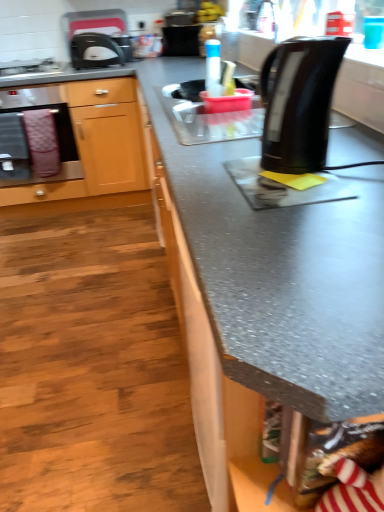
The width and height of the screenshot is (384, 512). What are the coordinates of `pink fabric towel at left` in the screenshot? It's located at (42, 142).

What is the approximate width of black glossy electric kettle at right?

It is 6.28 inches.

The height and width of the screenshot is (512, 384). I want to click on black glossy electric kettle at right, so click(x=299, y=102).

Identify the location of stainless steel oven at left. This screenshot has height=512, width=384. (36, 137).

Describe the element at coordinates (36, 137) in the screenshot. The width and height of the screenshot is (384, 512). I see `stainless steel oven at left` at that location.

This screenshot has height=512, width=384. Identify the location of black plastic toaster at upper left. (94, 51).

Describe the element at coordinates (97, 38) in the screenshot. I see `matte black toaster at upper left` at that location.

Find the location of `pink fabric towel at left`. pink fabric towel at left is located at coordinates (42, 142).

Considering the relative positions of white glossy gas stove at upper left and wooden cabinet at left in the image provided, is white glossy gas stove at upper left to the left of wooden cabinet at left from the viewer's perspective?

Yes.

From a real-world perspective, is white glossy gas stove at upper left on wooden cabinet at left?

Yes, from a real-world perspective, white glossy gas stove at upper left is over wooden cabinet at left

From the image's perspective, relative to wooden cabinet at left, is white glossy gas stove at upper left above or below?

white glossy gas stove at upper left is situated higher than wooden cabinet at left in the image.

From the picture: From the image's perspective, is matte black toaster at upper left above black glossy electric kettle at right?

Yes, from the image's perspective, matte black toaster at upper left is over black glossy electric kettle at right.

Is matte black toaster at upper left aimed at black glossy electric kettle at right?

Yes, matte black toaster at upper left is oriented towards black glossy electric kettle at right.

From a real-world perspective, is matte black toaster at upper left located beneath black glossy electric kettle at right?

No, from a real-world perspective, matte black toaster at upper left is not under black glossy electric kettle at right.

Is matte black toaster at upper left positioned beyond the bounds of black glossy electric kettle at right?

Absolutely, matte black toaster at upper left is external to black glossy electric kettle at right.

Is white glossy gas stove at upper left located outside pink fabric towel at left?

Yes, white glossy gas stove at upper left is located beyond the bounds of pink fabric towel at left.

What's the angular difference between white glossy gas stove at upper left and pink fabric towel at left's facing directions?

There is a 0.488-degree angle between the facing directions of white glossy gas stove at upper left and pink fabric towel at left.

From a real-world perspective, is white glossy gas stove at upper left above or below pink fabric towel at left?

white glossy gas stove at upper left is above pink fabric towel at left.

From the image's perspective, is white glossy gas stove at upper left on pink fabric towel at left?

Yes, from the image's perspective, white glossy gas stove at upper left is above pink fabric towel at left.

Does point (97, 170) come in front of point (10, 74)?

That is False.

Identify the location of gas stove behind the wooden cabinet at left. The width and height of the screenshot is (384, 512). (31, 67).

Between wooden cabinet at left and white glossy gas stove at upper left, which one has smaller width?

Thinner between the two is white glossy gas stove at upper left.

Is wooden cabinet at left located outside white glossy gas stove at upper left?

Yes.

From a real-world perspective, between black plastic toaster at upper left and matte black toaster at upper left, who is vertically higher?

From a 3D spatial view, matte black toaster at upper left is above.

In the scene shown: Relative to matte black toaster at upper left, is black plastic toaster at upper left in front or behind?

black plastic toaster at upper left is positioned closer to the viewer than matte black toaster at upper left.

Considering the relative positions of black plastic toaster at upper left and matte black toaster at upper left in the image provided, is black plastic toaster at upper left to the right of matte black toaster at upper left from the viewer's perspective?

Indeed, black plastic toaster at upper left is positioned on the right side of matte black toaster at upper left.

Considering the positions of points (209, 57) and (12, 64), is point (209, 57) farther from camera compared to point (12, 64)?

No.

Do you think transparent plastic bottle at center is within white glossy gas stove at upper left, or outside of it?

The correct answer is: outside.

Could you tell me if transparent plastic bottle at center is turned towards white glossy gas stove at upper left?

No, transparent plastic bottle at center is not facing towards white glossy gas stove at upper left.

Is transparent plastic bottle at center smaller than white glossy gas stove at upper left?

Indeed, transparent plastic bottle at center has a smaller size compared to white glossy gas stove at upper left.

Considering the positions of point (75, 42) and point (318, 81), is point (75, 42) closer or farther from the camera than point (318, 81)?

Clearly, point (75, 42) is more distant from the camera than point (318, 81).

Does black plastic toaster at upper left appear on the right side of black glossy electric kettle at right?

In fact, black plastic toaster at upper left is to the left of black glossy electric kettle at right.

Are black plastic toaster at upper left and black glossy electric kettle at right far apart?

black plastic toaster at upper left is positioned a significant distance from black glossy electric kettle at right.

What's the angular difference between black plastic toaster at upper left and black glossy electric kettle at right's facing directions?

The facing directions of black plastic toaster at upper left and black glossy electric kettle at right are 90.1 degrees apart.

Where is `gas stove above the wooden cabinet at left (from the image's perspective)`? This screenshot has height=512, width=384. gas stove above the wooden cabinet at left (from the image's perspective) is located at coordinates pos(31,67).

You are a GUI agent. You are given a task and a screenshot of the screen. Output one action in this format:
    pyautogui.click(x=<x>, y=<y>)
    Task: Click on the appliance on the left of black glossy electric kettle at right
    
    Given the screenshot: What is the action you would take?
    pyautogui.click(x=97, y=38)

Looking at the image, which one is located closer to matte black toaster at upper left, transparent plastic bottle at center or black glossy electric kettle at right?

transparent plastic bottle at center lies closer to matte black toaster at upper left than the other object.

Which object lies further to the anchor point black glossy electric kettle at right, transparent plastic bottle at center or pink fabric towel at left?

pink fabric towel at left is further to black glossy electric kettle at right.

In the scene shown: Based on their spatial positions, is black plastic toaster at upper left or transparent plastic bottle at center closer to pink fabric towel at left?

black plastic toaster at upper left.

Estimate the real-world distances between objects in this image. Which object is closer to black glossy electric kettle at right, white glossy gas stove at upper left or matte black toaster at upper left?

Among the two, matte black toaster at upper left is located nearer to black glossy electric kettle at right.

Looking at the image, which one is located closer to transparent plastic bottle at center, matte black toaster at upper left or white glossy gas stove at upper left?

The object closer to transparent plastic bottle at center is matte black toaster at upper left.

When comparing their distances from pink fabric towel at left, does wooden cabinet at left or stainless steel oven at left seem closer?

Based on the image, stainless steel oven at left appears to be nearer to pink fabric towel at left.

In the scene shown: Considering their positions, is black glossy electric kettle at right positioned further to wooden cabinet at left than stainless steel oven at left?

black glossy electric kettle at right lies further to wooden cabinet at left than the other object.

Looking at the image, which one is located closer to matte black toaster at upper left, black glossy electric kettle at right or transparent plastic bottle at center?

transparent plastic bottle at center is closer to matte black toaster at upper left.

At what (x,y) coordinates should I click in order to perform the action: click on gas stove positioned between transparent plastic bottle at center and matte black toaster at upper left from near to far. Please return your answer as a coordinate pair (x, y). Looking at the image, I should click on (31, 67).

Image resolution: width=384 pixels, height=512 pixels. Identify the location of bottle located between black glossy electric kettle at right and wooden cabinet at left in the depth direction. point(213,68).

At what (x,y) coordinates should I click in order to perform the action: click on appliance between white glossy gas stove at upper left and black plastic toaster at upper left. Please return your answer as a coordinate pair (x, y). Looking at the image, I should click on (97, 38).

This screenshot has height=512, width=384. What are the coordinates of `gas stove situated between stainless steel oven at left and black plastic toaster at upper left from left to right` in the screenshot? It's located at (31, 67).